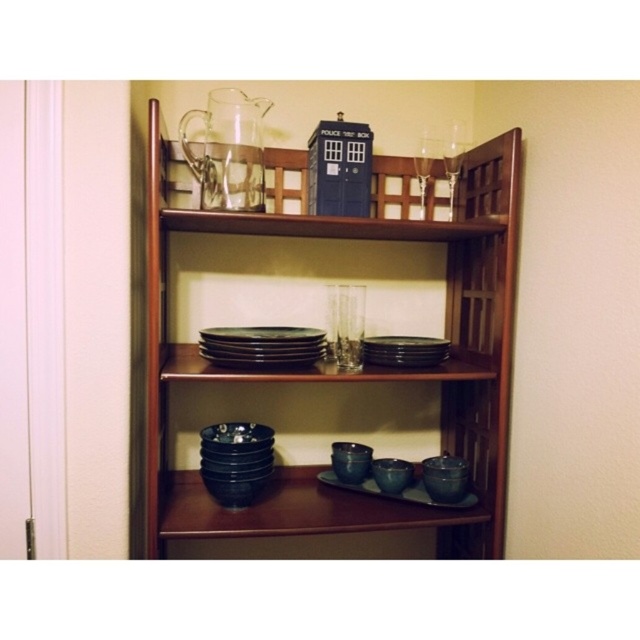
Question: Which point is farther to the camera?

Choices:
 (A) clear glass wine glass at upper right
 (B) black matte plate at center
 (C) dark wood bookshelf at center
 (D) black matte platter at center

Answer: (A)

Question: Which point is farther to the camera?

Choices:
 (A) clear glass wine glass at upper right
 (B) black matte plate at center

Answer: (A)

Question: Which point is farther to the camera?

Choices:
 (A) (476, 282)
 (B) (371, 346)
 (C) (460, 161)

Answer: (A)

Question: Is the position of dark wood bookshelf at center less distant than that of clear glass wine glass at upper right?

Choices:
 (A) no
 (B) yes

Answer: (B)

Question: Observing the image, what is the correct spatial positioning of matte black platter at center in reference to clear glass wine glass at upper right?

Choices:
 (A) right
 (B) left

Answer: (B)

Question: In this image, where is matte black platter at center located relative to clear glass wine glass at upper right?

Choices:
 (A) right
 (B) left

Answer: (B)